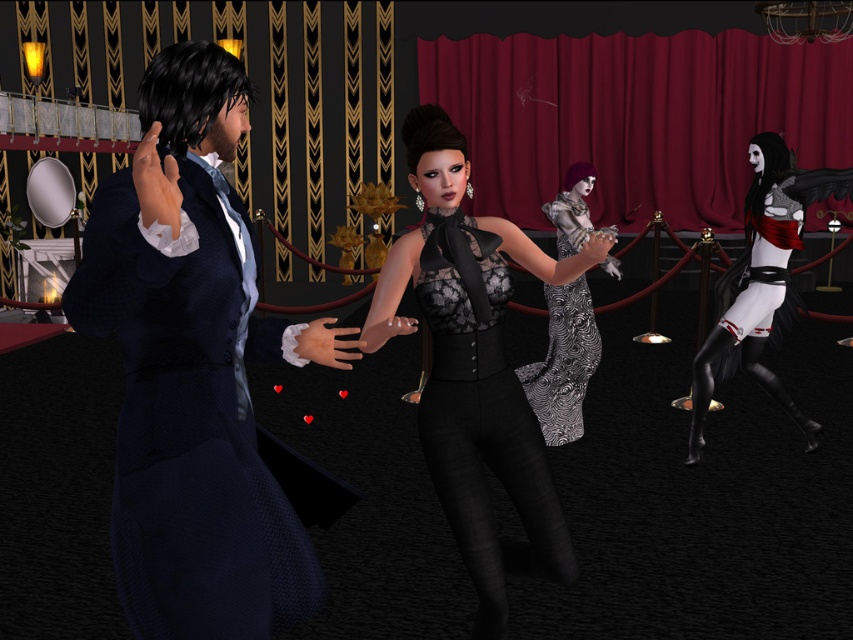
Which is in front, point (305, 589) or point (527, 378)?

Point (305, 589) is more forward.

Which of these two, velvet blue suit at left or silver metallic dress at center, stands shorter?

Standing shorter between the two is velvet blue suit at left.

Measure the distance between velvet blue suit at left and camera.

The distance of velvet blue suit at left from camera is 1.32 meters.

Where is `velvet blue suit at left`? This screenshot has height=640, width=853. velvet blue suit at left is located at coordinates (194, 369).

Looking at this image, does lace fabric dress at center appear over white matte dress at right?

No.

Is point (515, 394) positioned after point (780, 236)?

No, it is in front of (780, 236).

Locate an element on the screen. lace fabric dress at center is located at coordinates (474, 368).

Is white matte dress at right positioned in front of silver metallic dress at center?

That is False.

Is point (764, 259) more distant than point (576, 280)?

That is False.

Locate an element on the screen. The width and height of the screenshot is (853, 640). white matte dress at right is located at coordinates (763, 276).